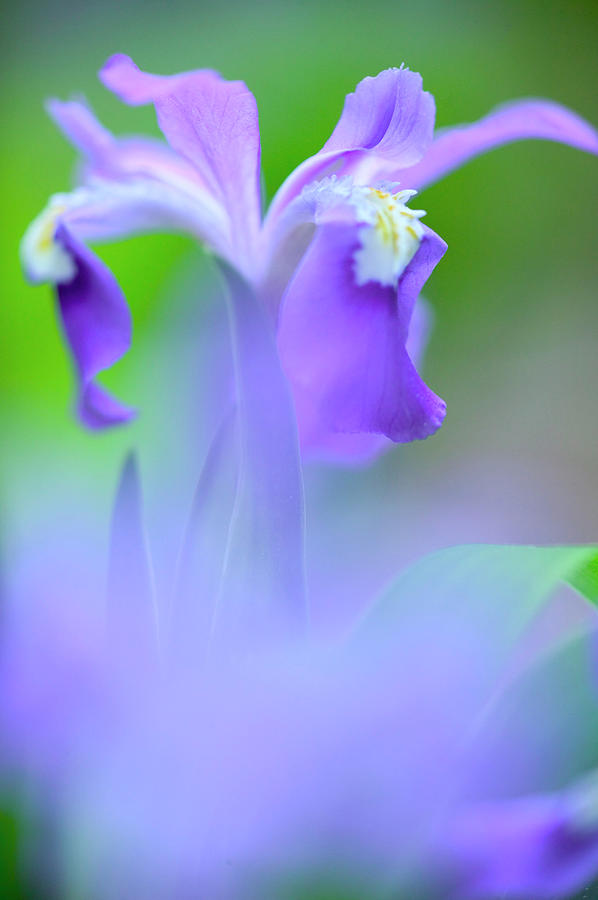
Locate an element on the screen. The image size is (598, 900). light blue pedestal is located at coordinates (350, 199).